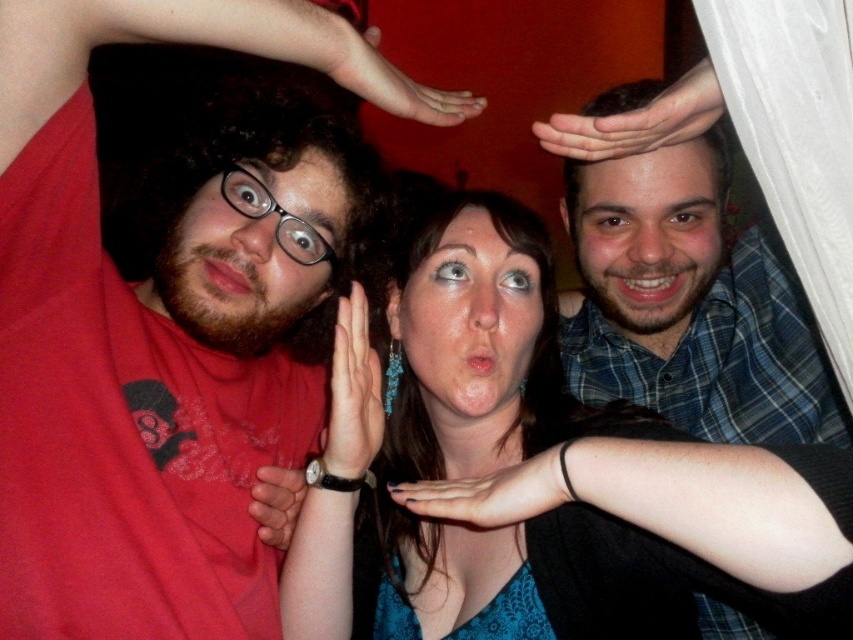
Which is above, matte red shirt at left or smooth skin hand at upper center?

smooth skin hand at upper center is higher up.

Does point (238, 163) come closer to viewer compared to point (426, 113)?

No, it is behind (426, 113).

This screenshot has height=640, width=853. I want to click on matte red shirt at left, so click(146, 344).

Between matte blue shirt at right and matte skin face at center, which one appears on the right side from the viewer's perspective?

matte blue shirt at right is more to the right.

Which is behind, point (691, 220) or point (410, 236)?

Point (691, 220)

Is point (585, 196) farther from camera compared to point (543, 291)?

Yes.

This screenshot has width=853, height=640. Find the location of `matte blue shirt at right`. matte blue shirt at right is located at coordinates (648, 236).

Is black matte hand at center below matte skin face at center?

Indeed, black matte hand at center is positioned under matte skin face at center.

Who is positioned more to the right, black matte hand at center or matte skin face at center?

Positioned to the right is black matte hand at center.

Is point (566, 448) positioned before point (405, 275)?

Yes, it is.

Where is `black matte hand at center`? The image size is (853, 640). black matte hand at center is located at coordinates (492, 492).